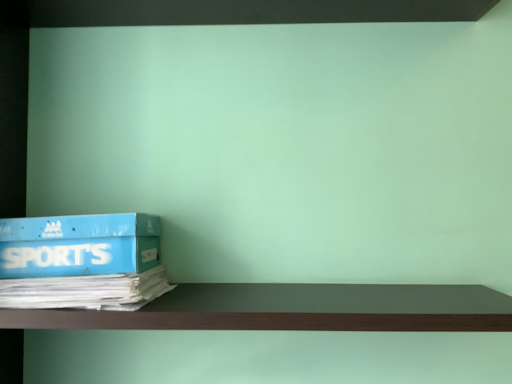
This screenshot has width=512, height=384. In order to click on blue cardboard box at left in this screenshot , I will do `click(79, 245)`.

Describe the element at coordinates (79, 245) in the screenshot. I see `blue cardboard box at left` at that location.

This screenshot has height=384, width=512. In order to click on blue cardboard box at left in this screenshot , I will do `click(79, 245)`.